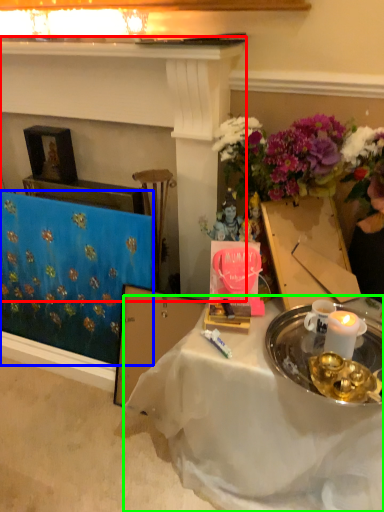
Question: Which object is positioned closest to fireplace (highlighted by a red box)? Select from tablecloth (highlighted by a blue box) and desk (highlighted by a green box).

Choices:
 (A) tablecloth
 (B) desk

Answer: (A)